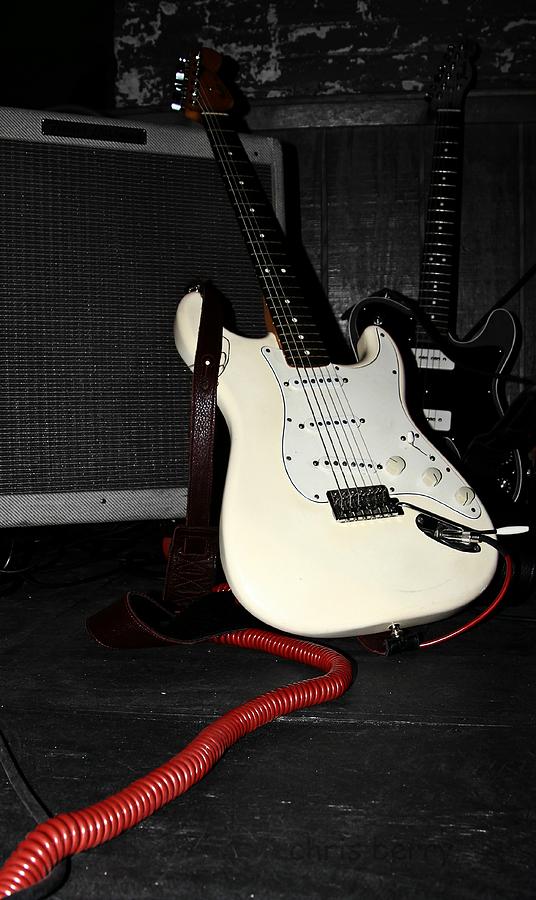
Find the location of a particular element. The width and height of the screenshot is (536, 900). speaker is located at coordinates (109, 258).